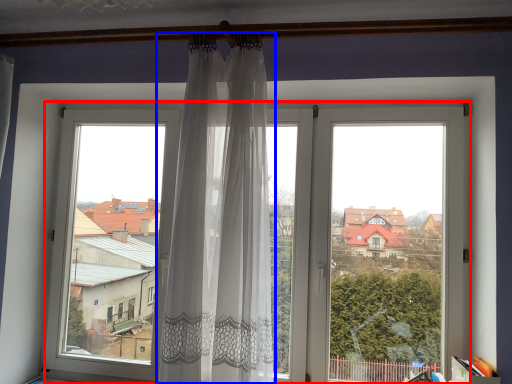
Question: Which point is closer to the camera, window (highlighted by a red box) or curtain (highlighted by a blue box)?

Choices:
 (A) window
 (B) curtain

Answer: (B)